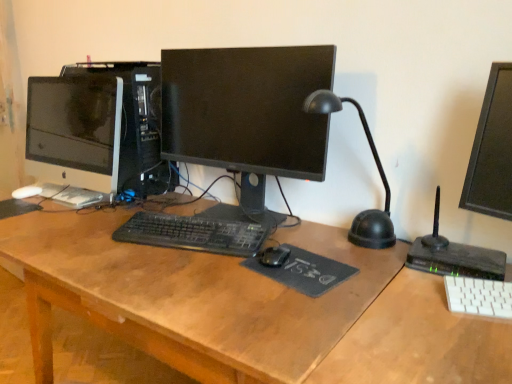
Question: Is point (250, 240) positioned closer to the camera than point (308, 236)?

Choices:
 (A) closer
 (B) farther

Answer: (A)

Question: From the image's perspective, is black matte keyboard at center, the 1th computer keyboard when ordered from back to front, positioned above or below wooden desk at center?

Choices:
 (A) above
 (B) below

Answer: (A)

Question: Estimate the real-world distances between objects in this image. Which object is closer to the black plastic desk lamp at center right?

Choices:
 (A) black plastic computer tower at center
 (B) black rubber mousepad at center, which is the second mousepad from bottom to top
 (C) black fabric mousepad at center, which appears as the 1th mousepad when viewed from the front
 (D) wooden desk at center
 (E) black matte mouse at center

Answer: (C)

Question: Which is nearer to the white glossy monitor at left, acting as the second computer monitor starting from the right?

Choices:
 (A) wooden desk at center
 (B) black plastic desk lamp at center right
 (C) black fabric mousepad at center, the 1th mousepad positioned from the bottom
 (D) black matte mouse at center
 (E) black plastic computer tower at center

Answer: (E)